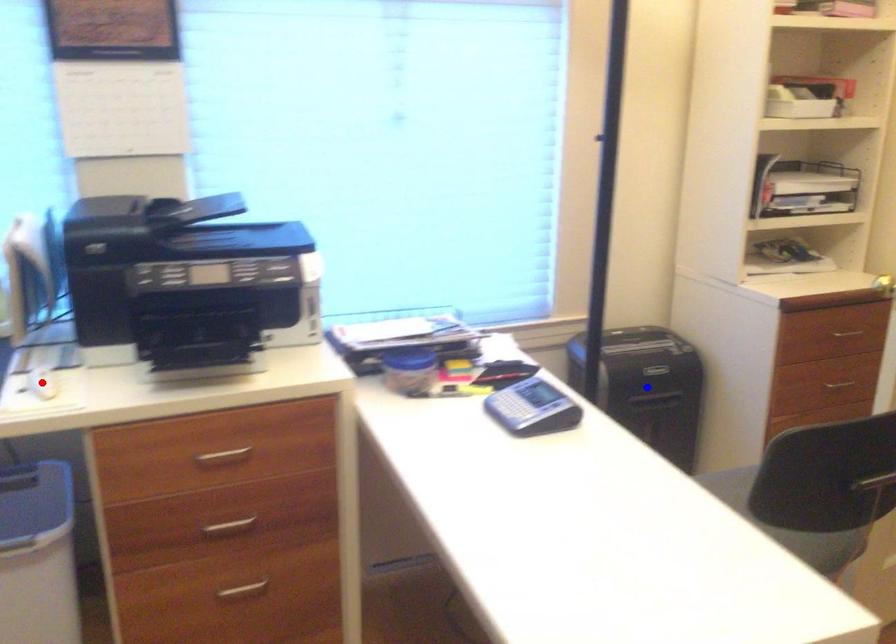
Question: Which of the two points in the image is closer to the camera?

Choices:
 (A) Blue point is closer.
 (B) Red point is closer.

Answer: (B)